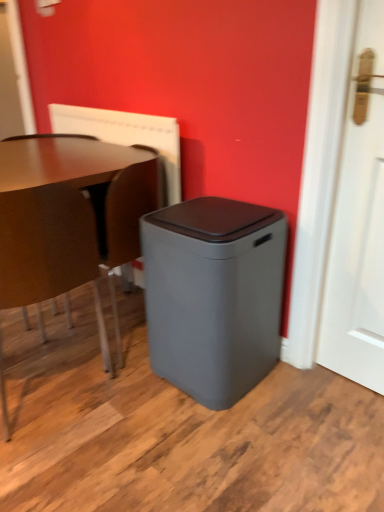
Where is `free location to the left of gray matte waste container at center`? The width and height of the screenshot is (384, 512). free location to the left of gray matte waste container at center is located at coordinates (124, 399).